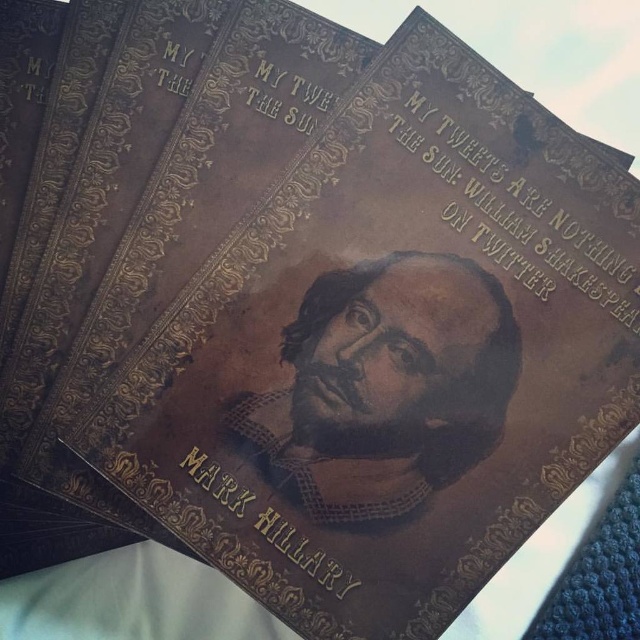
Is point (326, 289) farther from camera compared to point (289, 504)?

Yes, point (326, 289) is farther from viewer.

Is brown leather portrait at center shorter than gold embossed text at center?

No.

Find the location of `brown leather portrait at center`. brown leather portrait at center is located at coordinates (385, 387).